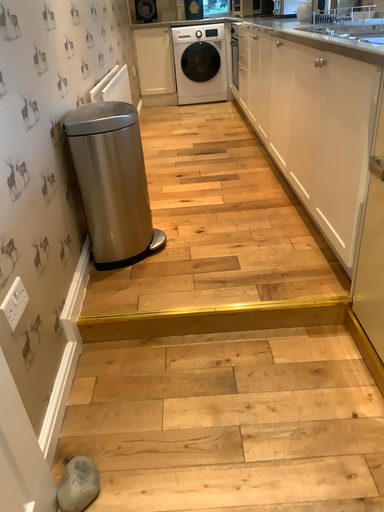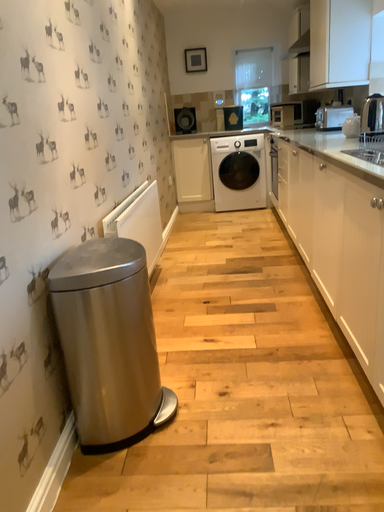
Question: How did the camera likely rotate when shooting the video?

Choices:
 (A) rotated upward
 (B) rotated downward

Answer: (A)